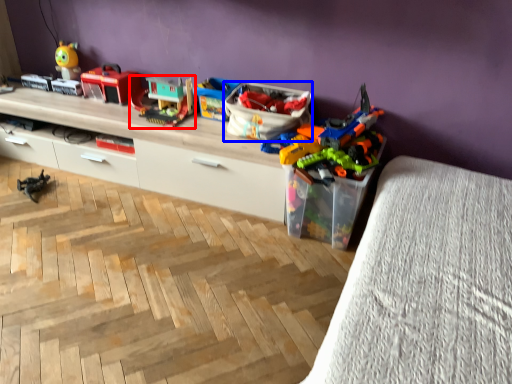
Question: Among these objects, which one is farthest to the camera, toy (highlighted by a red box) or storage box (highlighted by a blue box)?

Choices:
 (A) toy
 (B) storage box

Answer: (A)